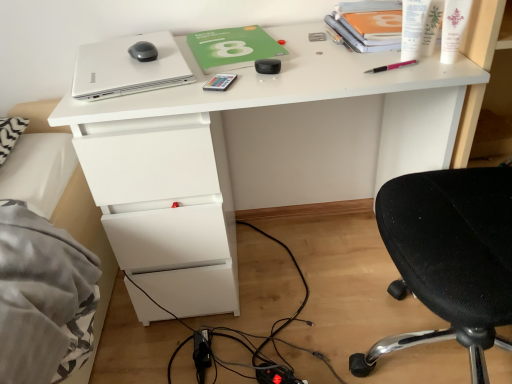
Question: From the image's perspective, is white glossy cream at upper right above or below green matte notebook at center?

Choices:
 (A) below
 (B) above

Answer: (A)

Question: Considering the positions of white glossy cream at upper right and green matte notebook at center in the image, is white glossy cream at upper right bigger or smaller than green matte notebook at center?

Choices:
 (A) small
 (B) big

Answer: (A)

Question: Considering the real-world distances, which object is farthest from the white glossy cream at upper right?

Choices:
 (A) silver metallic laptop at upper left
 (B) green matte notebook at center
 (C) white plastic pen at upper right, the 3th stationery when ordered from left to right
 (D) white glossy desk at center
 (E) metallic rectangular object at center, the 1th stationery in the left-to-right sequence

Answer: (A)

Question: Which object is the farthest from the green matte notebook at center?

Choices:
 (A) metallic rectangular object at center, the 1th stationery in the left-to-right sequence
 (B) white paper towel at upper right, which appears as the first stationery when viewed from the right
 (C) matte black mouse at upper left
 (D) white glossy cream at upper right
 (E) pink plastic pen at upper right, the second stationery in the left-to-right sequence

Answer: (D)